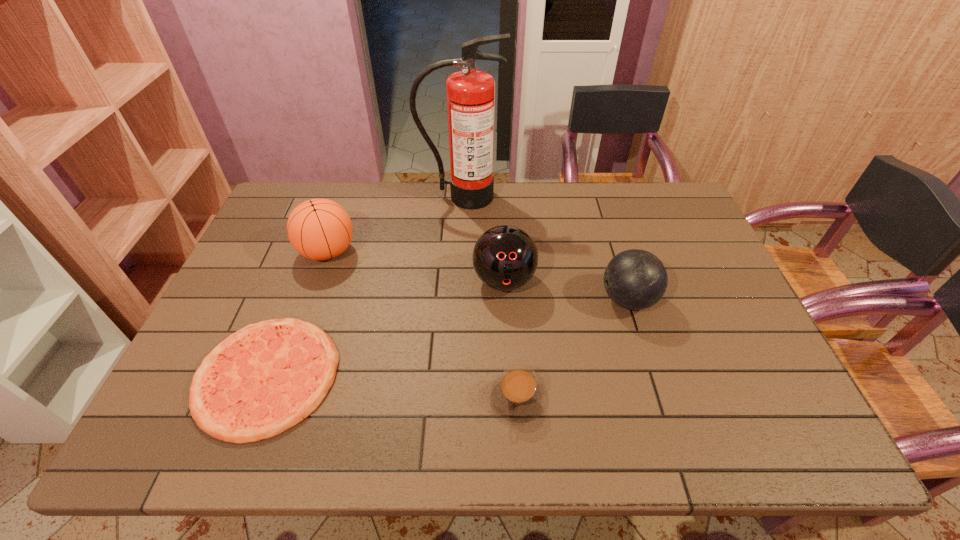
You are a GUI agent. You are given a task and a screenshot of the screen. Output one action in this format:
    pyautogui.click(x=<x>, y=<y>)
    Task: Click on the object situated at the near left corner
    Image resolution: width=960 pixels, height=540 pixels.
    Given the screenshot: What is the action you would take?
    (262, 380)

I want to click on vacant space at the far edge of the desktop, so click(500, 206).

In the image, there is a desktop. Where is `vacant area at the near edge`? vacant area at the near edge is located at coordinates (379, 440).

Where is `vacant space at the left edge of the desktop`? vacant space at the left edge of the desktop is located at coordinates (293, 275).

The height and width of the screenshot is (540, 960). In the image, there is a desktop. What are the coordinates of `vacant region at the right edge` in the screenshot? It's located at (692, 284).

In the image, there is a desktop. At what (x,y) coordinates should I click in order to perform the action: click on blank space at the far right corner. Please return your answer as a coordinate pair (x, y). This screenshot has height=540, width=960. Looking at the image, I should click on (660, 194).

You are a GUI agent. You are given a task and a screenshot of the screen. Output one action in this format:
    pyautogui.click(x=<x>, y=<y>)
    Task: Click on the empty space that is in between the left bowling ball and the fifth tallest object
    This screenshot has width=960, height=540.
    Given the screenshot: What is the action you would take?
    (511, 339)

At what (x,y) coordinates should I click in order to perform the action: click on unoccupied area between the pizza and the fifth tallest object. Please return your answer as a coordinate pair (x, y). This screenshot has height=540, width=960. Looking at the image, I should click on (393, 387).

Find the location of `free space between the basketball and the fire extinguisher`. free space between the basketball and the fire extinguisher is located at coordinates (395, 224).

The image size is (960, 540). Identify the location of empty space that is in between the shortest object and the fire extinguisher. (364, 286).